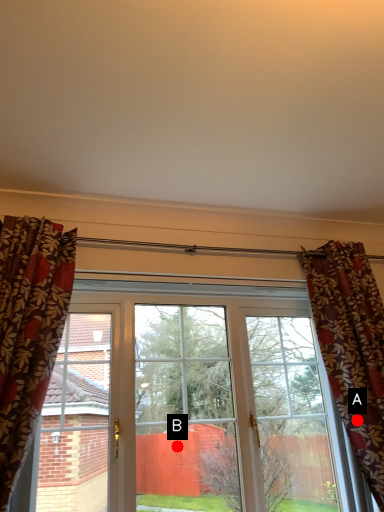
Question: Two points are circled on the image, labeled by A and B beside each circle. Which point is further to the camera?

Choices:
 (A) A is further
 (B) B is further

Answer: (B)